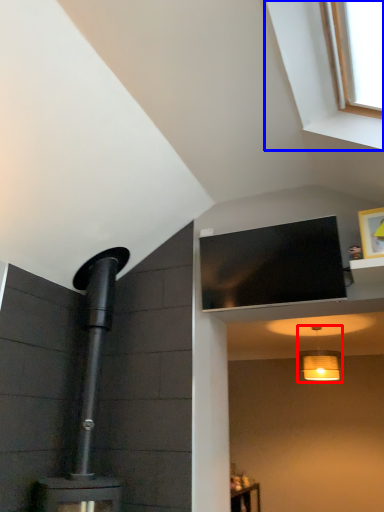
Question: Which object appears farthest to the camera in this image, light fixture (highlighted by a red box) or window (highlighted by a blue box)?

Choices:
 (A) light fixture
 (B) window

Answer: (A)